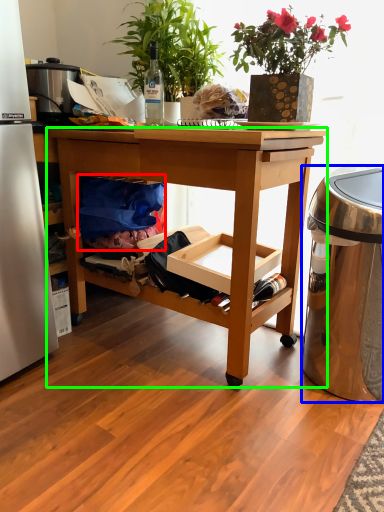
Question: Which object is the farthest from material (highlighted by a red box)? Choose among these: trash bin/can (highlighted by a blue box) or desk (highlighted by a green box).

Choices:
 (A) trash bin/can
 (B) desk

Answer: (A)